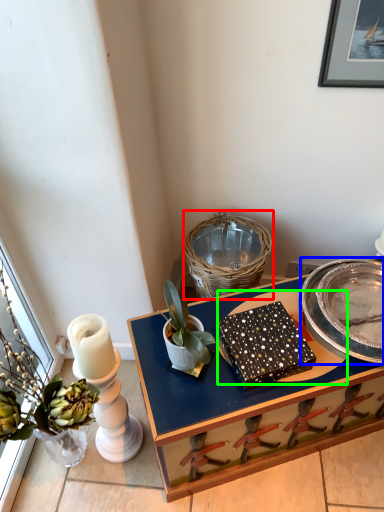
Question: Based on their relative distances, which object is farther from basket (highlighted by a red box)? Choose from plate (highlighted by a blue box) and glass plate (highlighted by a green box).

Choices:
 (A) plate
 (B) glass plate

Answer: (A)